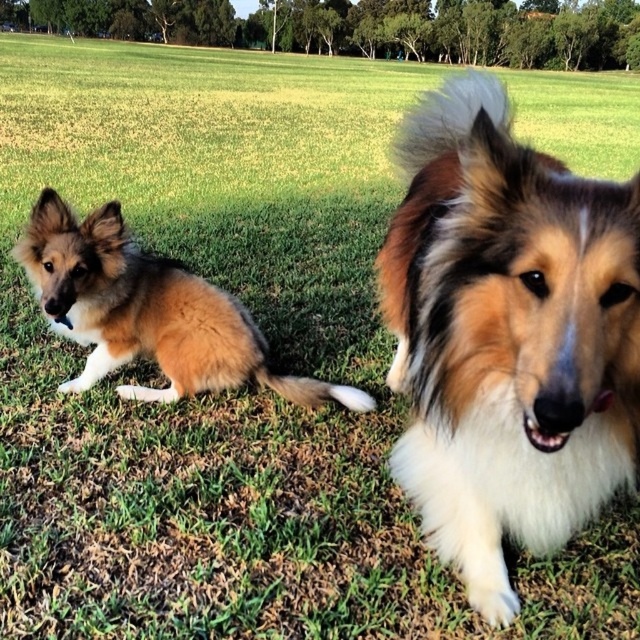
You are a dog trainer who needs to separate two dogs for safety. The fluffy brown dog at center and the brown fluffy dog at left are currently 1.00 meters apart. Can you safely place a 1.2 meter wide barrier between them without moving the dogs?

The fluffy brown dog at center and the brown fluffy dog at left are 1.00 meters apart from each other. Since the barrier is 1.2 meters wide, it is wider than the distance between them, so placing it between them would require moving the dogs closer together, which might not be safe. Therefore, the barrier cannot be placed without moving the dogs.

You are a photographer trying to capture a clear photo of both the fluffy brown dog at center and the brown fluffy dog at left. Based on their positions, which dog should you focus on first to ensure it appears sharp in the photo?

The fluffy brown dog at center should be focused on first because it is in front of the brown fluffy dog at left, making it closer to the camera.